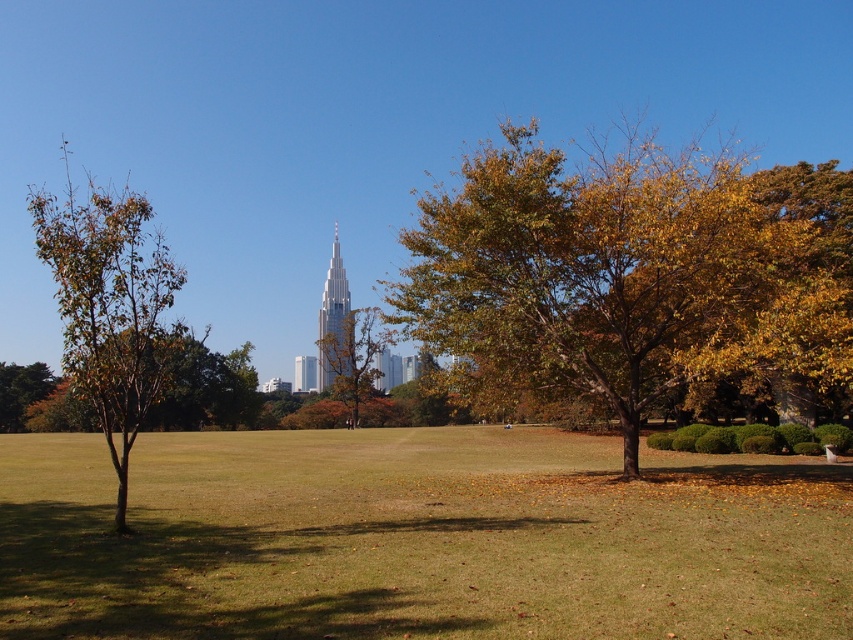
Who is shorter, autumn leaves tree at center or shiny glass skyscraper at center?

Standing shorter between the two is autumn leaves tree at center.

Who is lower down, autumn leaves tree at center or shiny glass skyscraper at center?

autumn leaves tree at center is lower down.

Who is more distant from viewer, (364, 333) or (325, 332)?

Point (325, 332)

Find the location of a particular element. The image size is (853, 640). autumn leaves tree at center is located at coordinates (354, 356).

Does yellow-green foliage at center appear on the right side of shiny glass skyscraper at center?

Yes, yellow-green foliage at center is to the right of shiny glass skyscraper at center.

Who is taller, yellow-green foliage at center or shiny glass skyscraper at center?

yellow-green foliage at center is taller.

Does point (705, 253) come behind point (339, 289)?

No, it is not.

The width and height of the screenshot is (853, 640). In order to click on yellow-green foliage at center in this screenshot , I will do `click(618, 276)`.

Who is more distant from viewer, (434, 470) or (341, 288)?

Positioned behind is point (341, 288).

Is green grass at center taller than shiny glass skyscraper at center?

No.

Who is more forward, (563, 513) or (329, 381)?

Positioned in front is point (563, 513).

Identify the location of green grass at center. This screenshot has height=640, width=853. (418, 538).